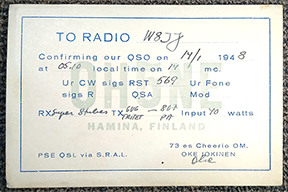
Locate an element on the screen. The image size is (288, 192). grey fabric surface is located at coordinates (176, 2).